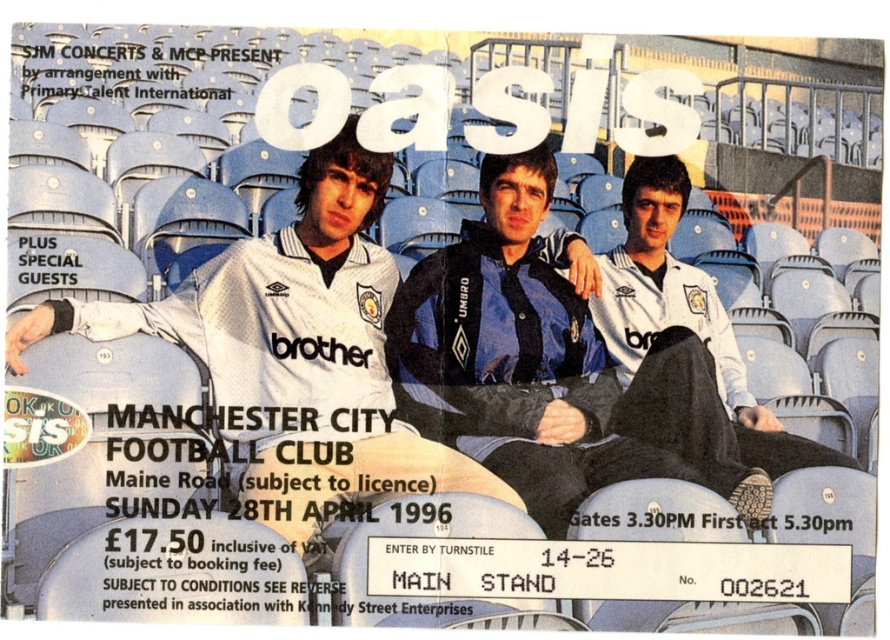
Question: Is blue jersey at center thinner than white jersey at center?

Choices:
 (A) no
 (B) yes

Answer: (B)

Question: Among these objects, which one is farthest from the camera?

Choices:
 (A) white jersey at center
 (B) blue jersey at center

Answer: (B)

Question: Can you confirm if blue jersey at center is smaller than white jersey at center?

Choices:
 (A) no
 (B) yes

Answer: (B)

Question: Can you confirm if blue jersey at center is positioned to the left of white jersey at center?

Choices:
 (A) no
 (B) yes

Answer: (A)